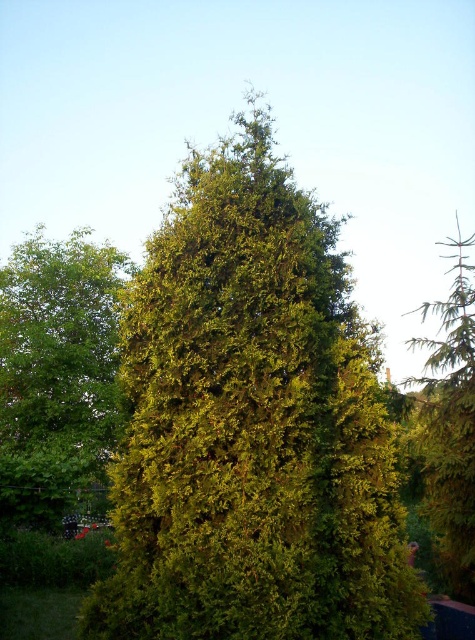
Can you confirm if green textured tree at center is positioned to the right of green textured evergreen tree at right?

In fact, green textured tree at center is to the left of green textured evergreen tree at right.

Is point (293, 378) farther from camera compared to point (467, 262)?

No.

Locate an element on the screen. green textured tree at center is located at coordinates (252, 424).

Can you confirm if green textured tree at center is smaller than green leafy tree at center?

No.

Consider the image. Which is above, green textured tree at center or green leafy tree at center?

green textured tree at center

Between point (392, 532) and point (45, 390), which one is positioned behind?

The point (45, 390) is more distant.

Image resolution: width=475 pixels, height=640 pixels. In order to click on green textured tree at center in this screenshot , I will do `click(252, 424)`.

Which is more to the left, green leafy tree at center or green textured evergreen tree at right?

green leafy tree at center is more to the left.

Does green leafy tree at center appear over green textured evergreen tree at right?

No.

Does point (93, 417) come in front of point (464, 596)?

No, (93, 417) is behind (464, 596).

Find the location of a particular element. The width and height of the screenshot is (475, 640). green leafy tree at center is located at coordinates pyautogui.click(x=56, y=372).